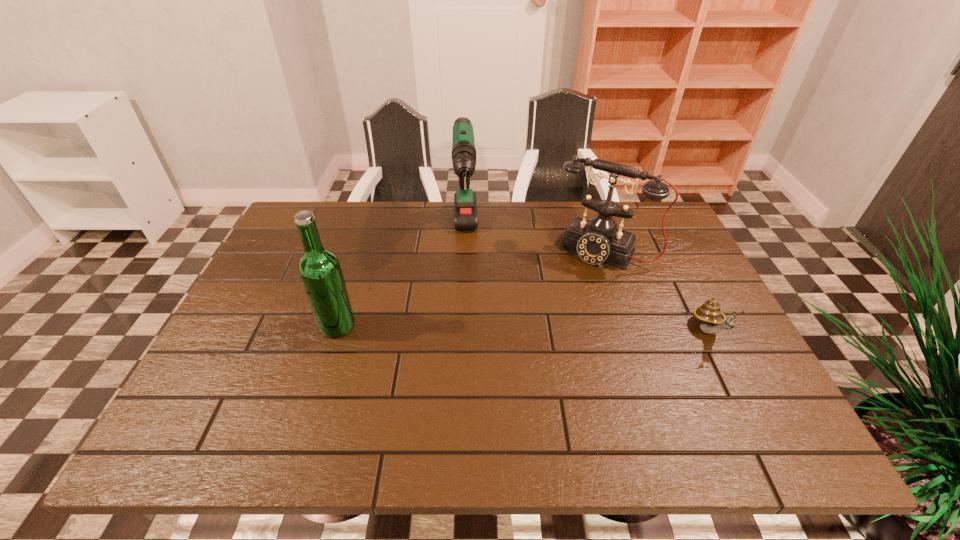
Locate an element on the screen. The height and width of the screenshot is (540, 960). vacant space that is in between the shortest object and the drill is located at coordinates (588, 284).

Find the location of a particular element. vacant area that lies between the second object from left to right and the shortest object is located at coordinates (588, 284).

The image size is (960, 540). Find the location of `vacant point located between the third object from left to right and the leftmost object`. vacant point located between the third object from left to right and the leftmost object is located at coordinates (470, 288).

This screenshot has height=540, width=960. What are the coordinates of `vacant area between the leftmost object and the drill` in the screenshot? It's located at (401, 281).

Find the location of a particular element. The image size is (960, 540). object that is the closest to the drill is located at coordinates (596, 241).

Locate an element on the screen. object that can be found as the closest to the shortest object is located at coordinates (596, 241).

Find the location of a particular element. The height and width of the screenshot is (540, 960). free location that satisfies the following two spatial constraints: 1. on the back side of the leftmost object; 2. on the right side of the drill is located at coordinates (366, 236).

Locate an element on the screen. Image resolution: width=960 pixels, height=540 pixels. free space in the image that satisfies the following two spatial constraints: 1. on the back side of the beer bottle; 2. on the right side of the drill is located at coordinates (366, 236).

At what (x,y) coordinates should I click in order to perform the action: click on vacant space that satisfies the following two spatial constraints: 1. on the back side of the beer bottle; 2. on the left side of the third object from right to left. Please return your answer as a coordinate pair (x, y). Looking at the image, I should click on (366, 236).